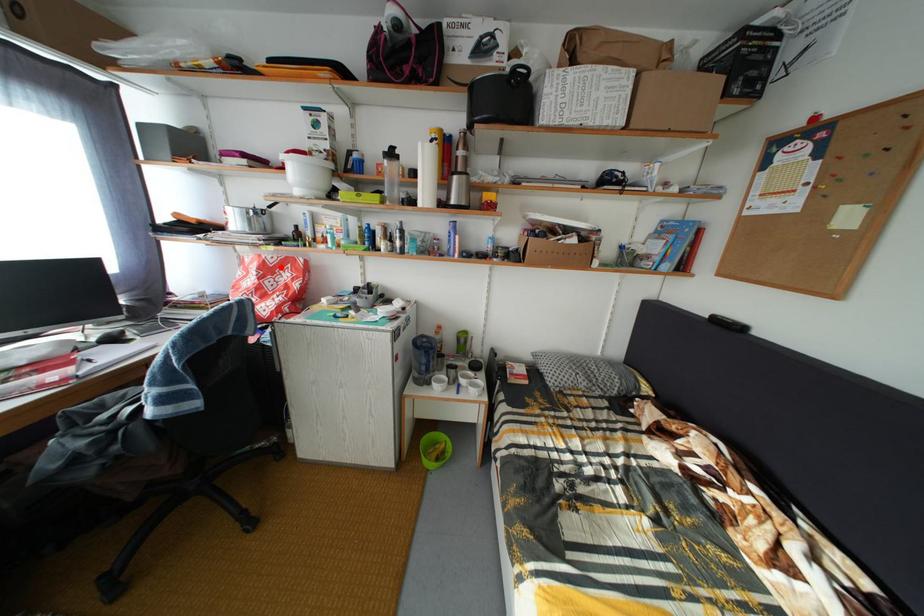
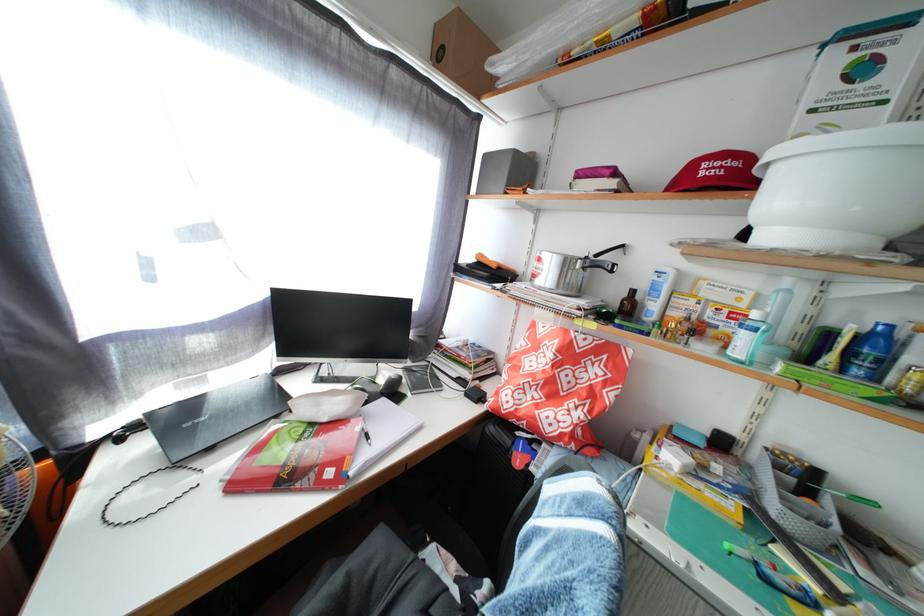
In the second image, find the point that corresponds to the highlighted location in the first image.

(590, 350)